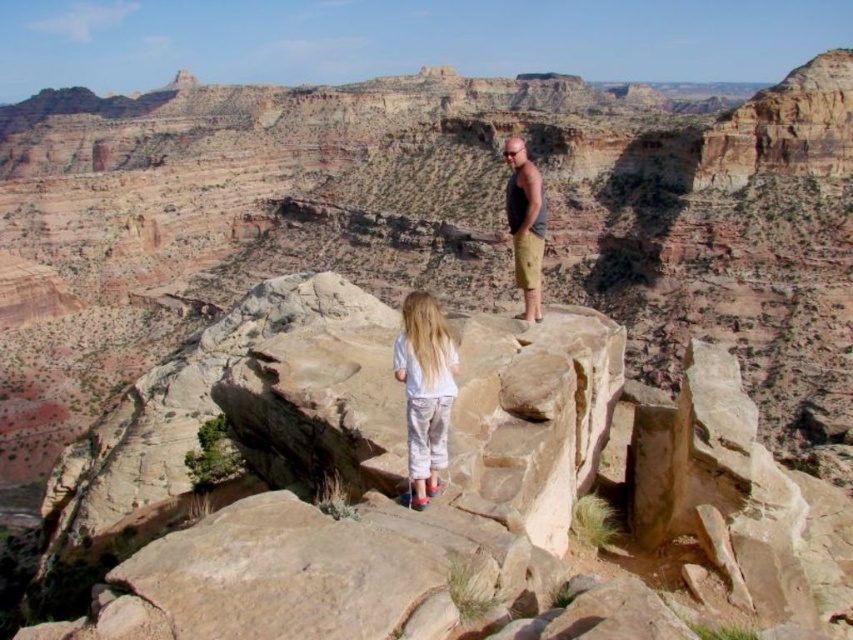
You are a photographer planning to take a portrait of two people wearing a light blue cotton shirt at center and a matte black tank top at center. Based on their positions, which clothing item is closer to the camera?

The light blue cotton shirt at center is located below the matte black tank top at center, meaning it is closer to the camera.

You are a photographer planning to capture a group photo of the two people in the desert scene. The camera you are using has a maximum focus range of 40 feet. Can both the light blue cotton shirt at center and the matte black tank top at center be in focus simultaneously?

The distance between the light blue cotton shirt at center and the matte black tank top at center is 42.23 feet, which exceeds the camera maximum focus range of 40 feet. Therefore, both cannot be in focus simultaneously.

You are a photographer planning to take a photo of the light blue cotton shirt at center. The camera has a focal length of 50mm. To ensure the shirt is in the center of the photo, where should you aim the camera? Please provide coordinates in the format of a point like x,y.

The light blue cotton shirt at center is located at point (425, 390), so you should aim the camera at those coordinates to center it.